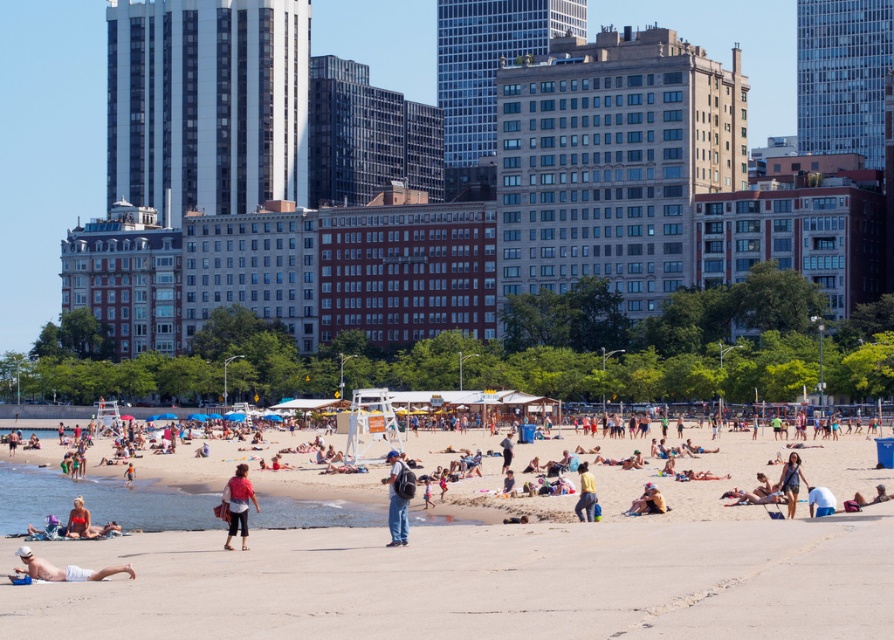
Question: Which point is farther from the camera taking this photo?

Choices:
 (A) (36, 563)
 (B) (333, 625)

Answer: (A)

Question: Which object appears closest to the camera in this image?

Choices:
 (A) white cotton towel at lower left
 (B) beige sand beach at center
 (C) matte pink shirt at center
 (D) denim shorts at lower right

Answer: (B)

Question: Which object is positioned farthest from the denim jeans at center?

Choices:
 (A) yellow knit sweater at center
 (B) white cotton towel at lower left
 (C) matte pink shirt at center

Answer: (B)

Question: Can you confirm if white cotton towel at lower left is positioned above yellow knit sweater at center?

Choices:
 (A) yes
 (B) no

Answer: (A)

Question: Does yellow knit sweater at center appear on the left side of tan leather bag at center?

Choices:
 (A) yes
 (B) no

Answer: (A)

Question: Can you confirm if matte pink shirt at center is smaller than tan leather bag at center?

Choices:
 (A) no
 (B) yes

Answer: (A)